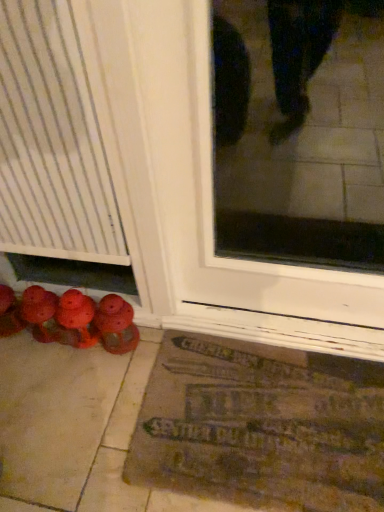
Where is `vacant space that is in between matte red shoes at lower left, which is counted as the second footwear, starting from the right, and brown textured mat at lower center`? The image size is (384, 512). vacant space that is in between matte red shoes at lower left, which is counted as the second footwear, starting from the right, and brown textured mat at lower center is located at coordinates (90, 391).